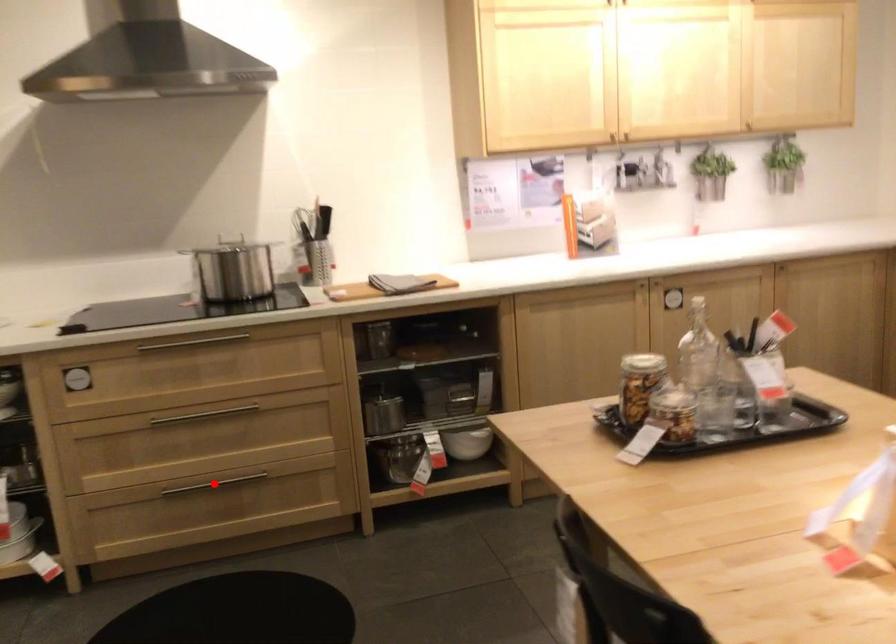
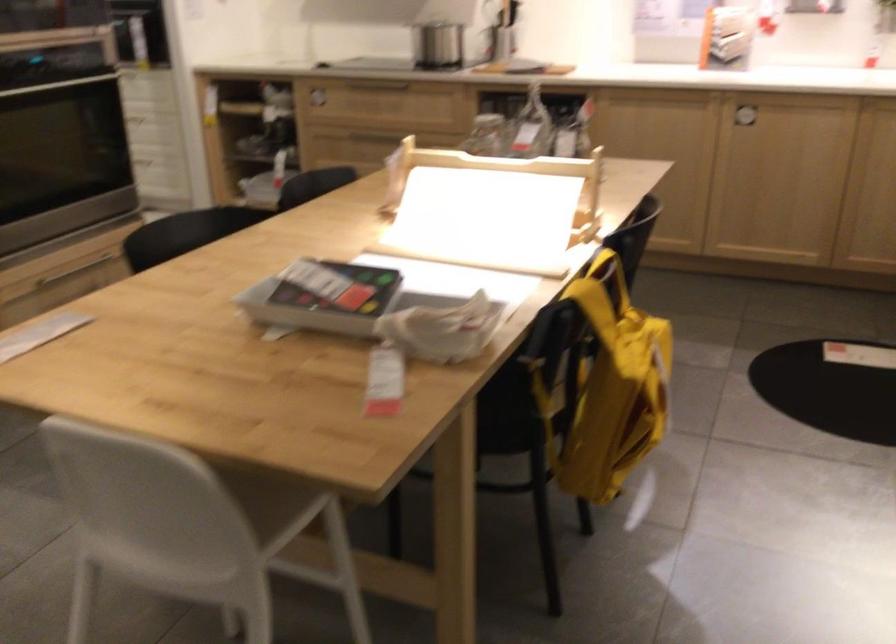
Question: I am providing you with two images of the same scene from different viewpoints. A red point is marked on the first image. Is the red point's position out of view in image 2?

Choices:
 (A) Yes
 (B) No

Answer: (A)